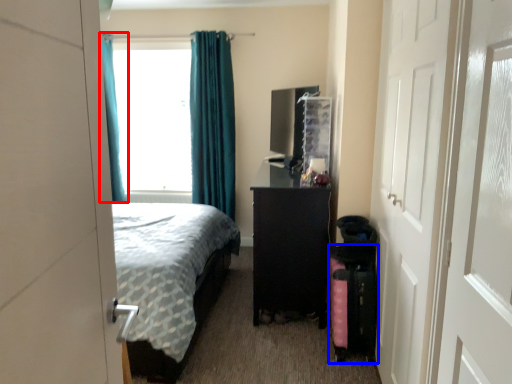
Question: Which object is closer to the camera taking this photo, curtain (highlighted by a red box) or luggage (highlighted by a blue box)?

Choices:
 (A) curtain
 (B) luggage

Answer: (B)